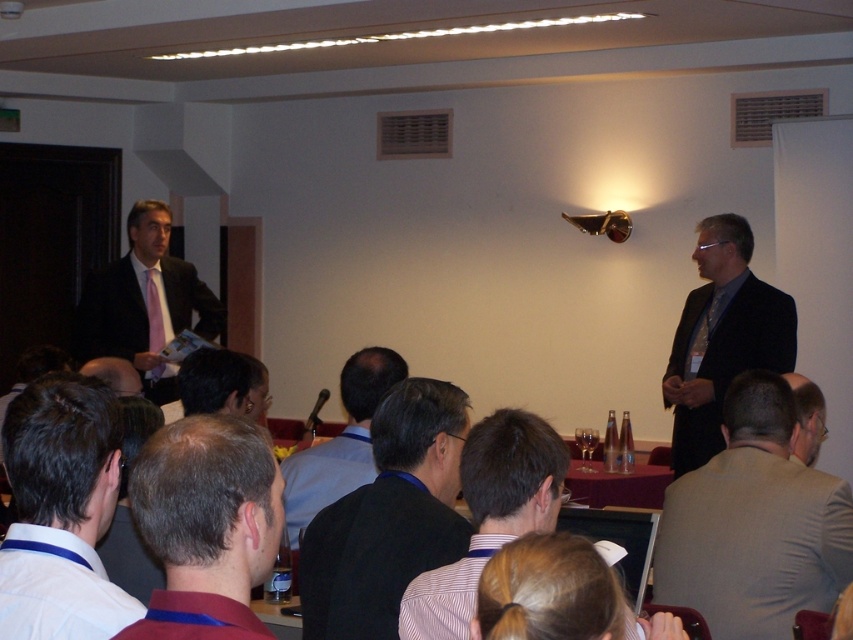
Which is behind, point (148, 621) or point (192, 307)?

The point (192, 307) is more distant.

Between point (248, 497) and point (138, 326), which one is positioned in front?

Point (248, 497)

Identify the location of brown hair at center. pos(206,525).

Does white shirt at lower left have a lesser height compared to matte black suit at left?

Indeed, white shirt at lower left has a lesser height compared to matte black suit at left.

Which of these two, white shirt at lower left or matte black suit at left, stands taller?

matte black suit at left is taller.

This screenshot has height=640, width=853. What do you see at coordinates (61, 512) in the screenshot? I see `white shirt at lower left` at bounding box center [61, 512].

I want to click on white shirt at lower left, so click(61, 512).

From the picture: Between light gray suit at right and white shirt at lower left, which one has more height?

light gray suit at right is taller.

The height and width of the screenshot is (640, 853). In order to click on light gray suit at right in this screenshot , I will do `click(753, 524)`.